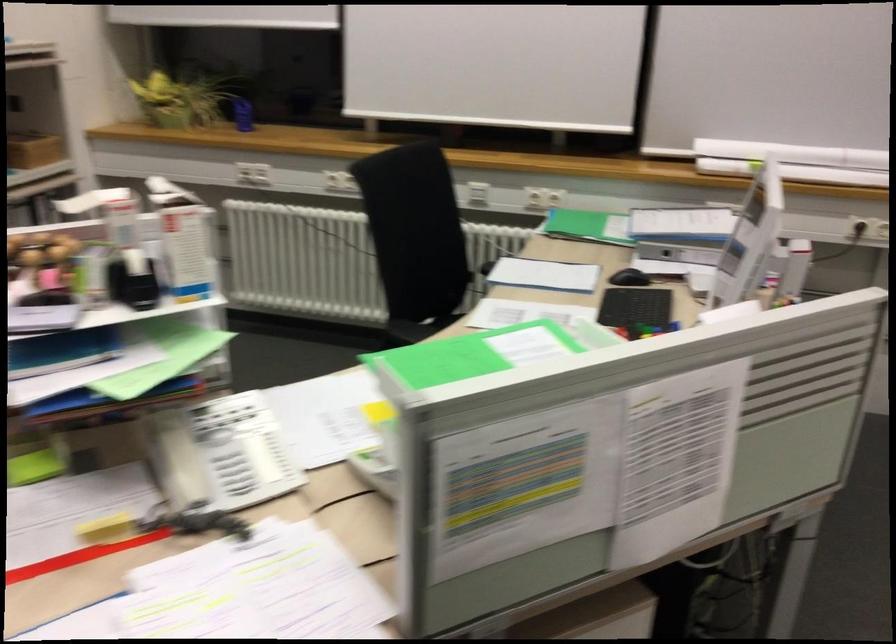
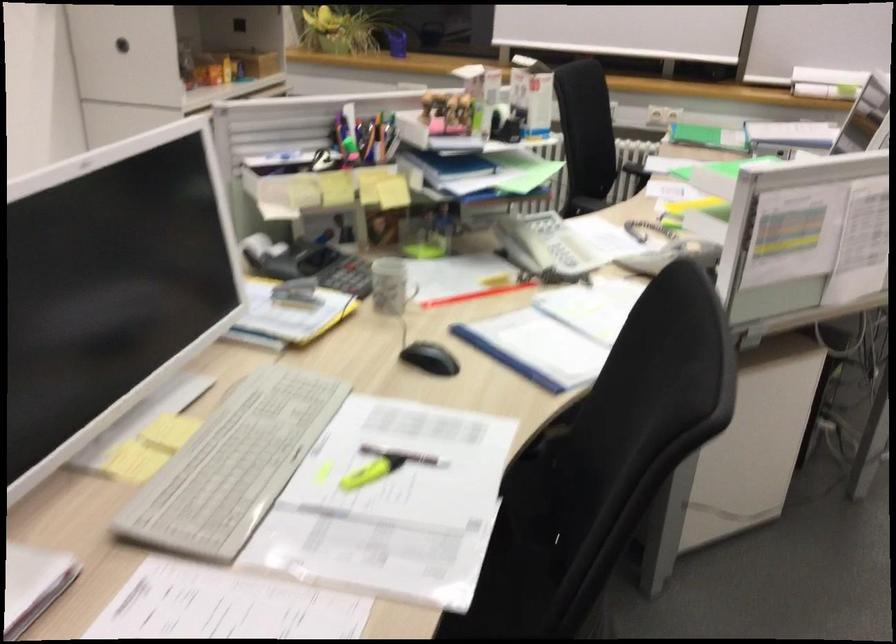
Where in the second image is the point corresponding to [174,465] from the first image?

(522, 243)